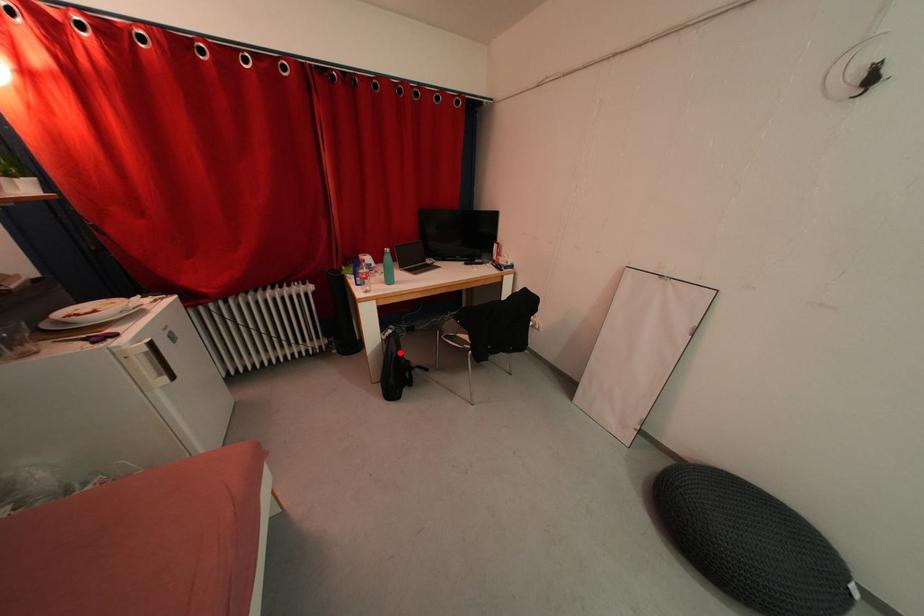
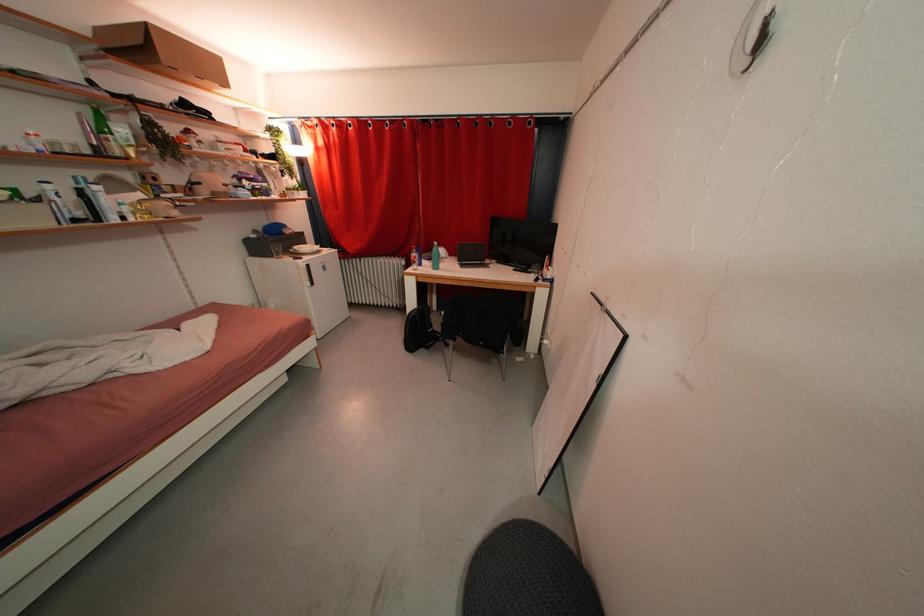
Where in the second image is the point corresponding to the highlighted location from the first image?

(419, 317)